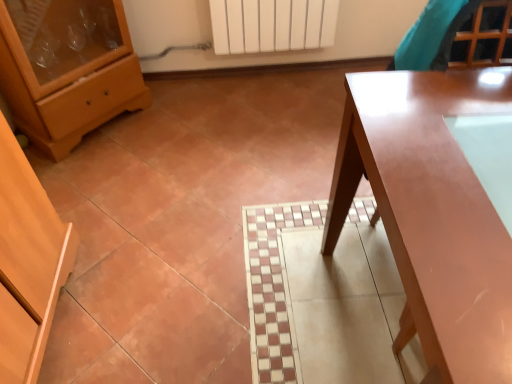
Locate an element on the screen. The width and height of the screenshot is (512, 384). vacant area located to the right-hand side of matte wood chest of drawers at left is located at coordinates (183, 125).